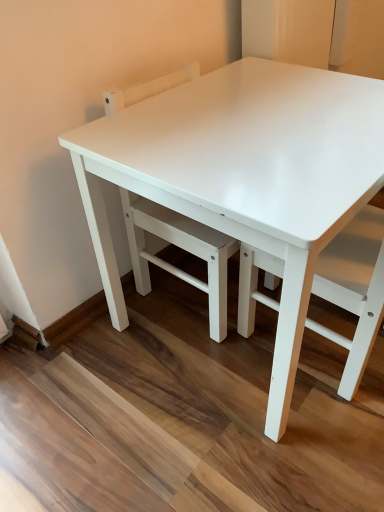
Question: Is the depth of white matte chair at center greater than that of white glossy table top at center?

Choices:
 (A) no
 (B) yes

Answer: (A)

Question: Is white glossy table top at center surrounded by white matte chair at center?

Choices:
 (A) no
 (B) yes

Answer: (A)

Question: Does white matte chair at center have a greater height compared to white glossy table top at center?

Choices:
 (A) no
 (B) yes

Answer: (B)

Question: Is white matte chair at center next to white glossy table top at center?

Choices:
 (A) no
 (B) yes

Answer: (A)

Question: From a real-world perspective, is white matte chair at center located beneath white glossy table top at center?

Choices:
 (A) yes
 (B) no

Answer: (A)

Question: Is point (240, 172) closer or farther from the camera than point (243, 81)?

Choices:
 (A) closer
 (B) farther

Answer: (A)

Question: Is white glossy table at center bigger or smaller than white glossy table top at center?

Choices:
 (A) small
 (B) big

Answer: (B)

Question: Considering the positions of white glossy table at center and white glossy table top at center in the image, is white glossy table at center taller or shorter than white glossy table top at center?

Choices:
 (A) tall
 (B) short

Answer: (A)

Question: Considering the relative positions of white glossy table at center and white glossy table top at center in the image provided, is white glossy table at center to the left or to the right of white glossy table top at center?

Choices:
 (A) right
 (B) left

Answer: (A)

Question: Is white matte chair at center inside or outside of white glossy table top at center?

Choices:
 (A) inside
 (B) outside

Answer: (B)

Question: Based on their sizes in the image, would you say white matte chair at center is bigger or smaller than white glossy table top at center?

Choices:
 (A) small
 (B) big

Answer: (B)

Question: From the image's perspective, is white matte chair at center above or below white glossy table top at center?

Choices:
 (A) above
 (B) below

Answer: (B)

Question: From a real-world perspective, is white matte chair at center above or below white glossy table top at center?

Choices:
 (A) below
 (B) above

Answer: (A)

Question: From their relative heights in the image, would you say white glossy table top at center is taller or shorter than white matte chair at center?

Choices:
 (A) short
 (B) tall

Answer: (A)

Question: In terms of size, does white glossy table top at center appear bigger or smaller than white matte chair at center?

Choices:
 (A) big
 (B) small

Answer: (B)